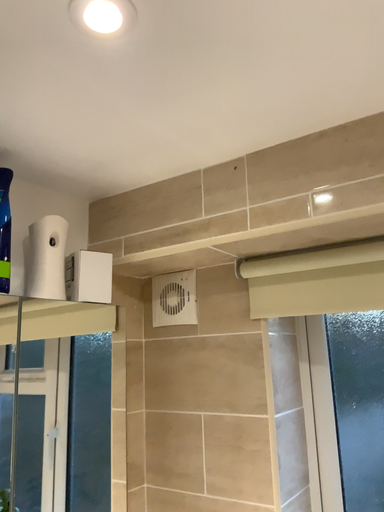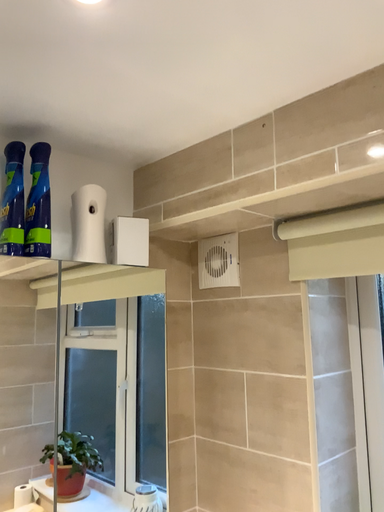
Question: Which way did the camera rotate in the video?

Choices:
 (A) rotated right
 (B) rotated left

Answer: (B)